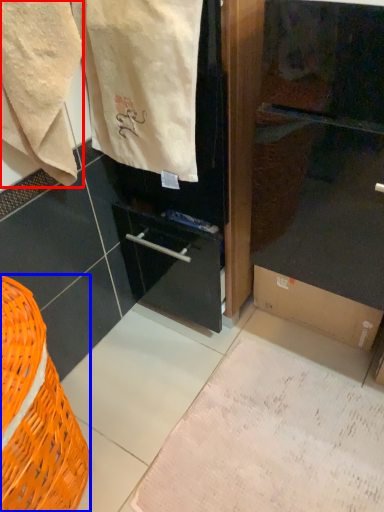
Question: Which of the following is the closest to the observer, towel (highlighted by a red box) or basket (highlighted by a blue box)?

Choices:
 (A) towel
 (B) basket

Answer: (B)